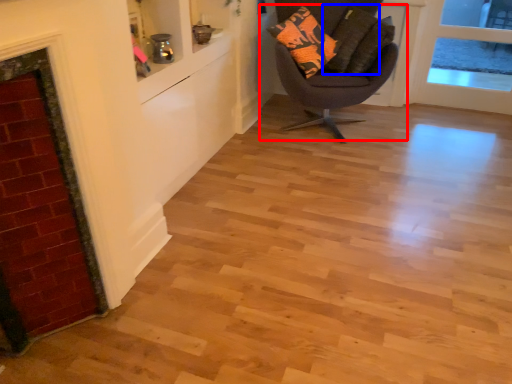
Question: Which point is further to the camera, chair (highlighted by a red box) or pillow (highlighted by a blue box)?

Choices:
 (A) chair
 (B) pillow

Answer: (B)